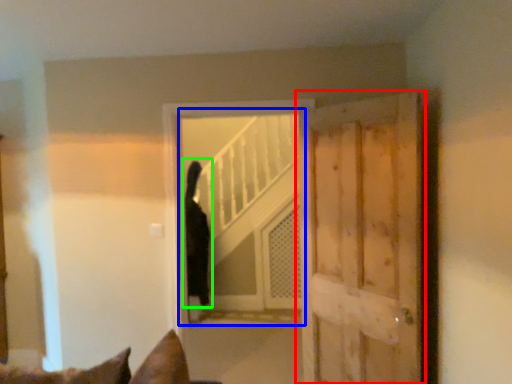
Question: Which object is the farthest from door (highlighted by a red box)? Choose among these: elevator (highlighted by a blue box) or cat (highlighted by a green box).

Choices:
 (A) elevator
 (B) cat

Answer: (A)